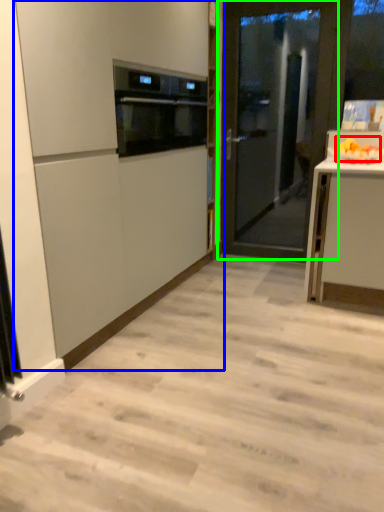
Question: Considering the real-world distances, which object is farthest from fruit (highlighted by a red box)? cabinetry (highlighted by a blue box) or door (highlighted by a green box)?

Choices:
 (A) cabinetry
 (B) door

Answer: (A)